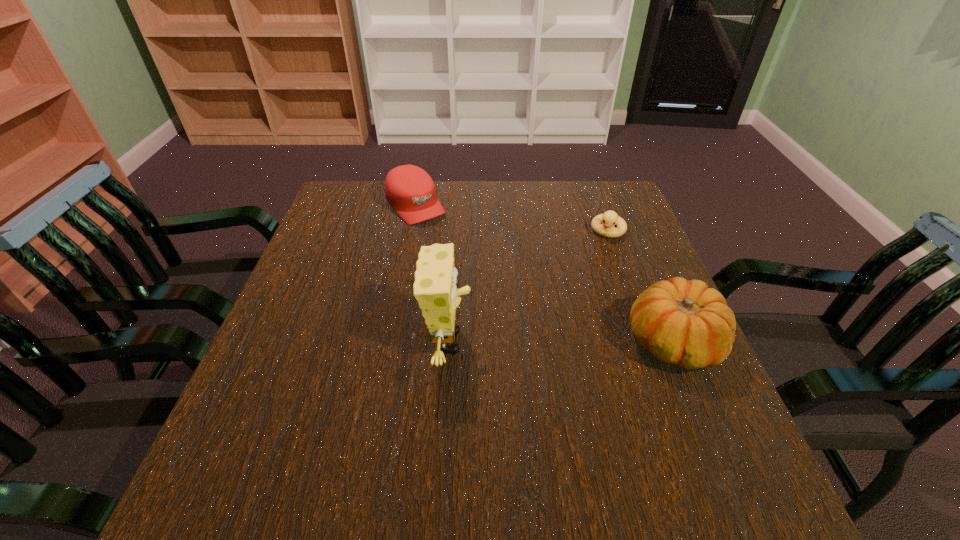
The width and height of the screenshot is (960, 540). I want to click on vacant spot on the desktop that is between the tallest object and the gourd and is positioned at the beak of the duckling, so click(571, 342).

Identify the location of vacant space on the desktop that is between the sponge and the gourd and is positioned on the front-facing side of the cap. This screenshot has height=540, width=960. (547, 342).